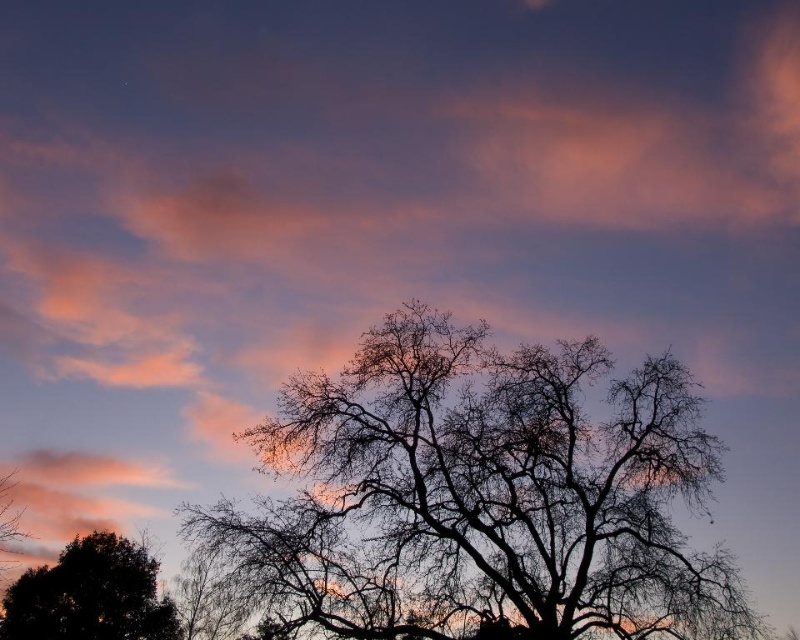
Question: From the image, what is the correct spatial relationship of black silhouette tree at center in relation to dark green leafy tree at lower left?

Choices:
 (A) below
 (B) above

Answer: (B)

Question: Which of the following is the closest to the observer?

Choices:
 (A) black silhouette tree at center
 (B) dark green leafy tree at lower left

Answer: (A)

Question: Can you confirm if black silhouette tree at center is positioned to the left of dark green leafy tree at lower left?

Choices:
 (A) yes
 (B) no

Answer: (B)

Question: Among these objects, which one is farthest from the camera?

Choices:
 (A) black silhouette tree at center
 (B) dark green leafy tree at lower left

Answer: (B)

Question: Which point is farther to the camera?

Choices:
 (A) dark green leafy tree at lower left
 (B) black silhouette tree at center

Answer: (A)

Question: Does black silhouette tree at center come behind dark green leafy tree at lower left?

Choices:
 (A) no
 (B) yes

Answer: (A)